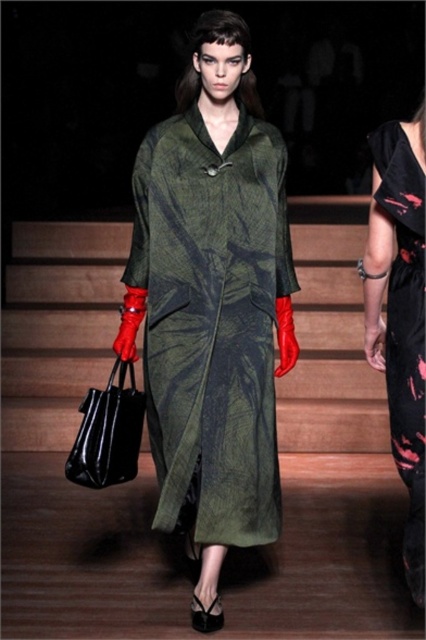
You are a photographer at a fashion show and need to position your camera to capture the matte green dress at center. According to the coordinates provided, where should you aim your camera?

You should aim your camera at the coordinates point [212,305] to capture the matte green dress at center.

You are a fashion designer observing the runway show. You notice the ripped black dress at right and the black leather bag at lower left. Which item has a narrower width?

The ripped black dress at right is thinner than the black leather bag at lower left, so the ripped black dress at right has a narrower width.

You are a photographer at the runway show and need to capture a photo where the matte green dress at center and the black leather bag at lower left are both visible. Considering their sizes, which object should you focus on to ensure both are in frame without cropping?

The matte green dress at center is much taller than the black leather bag at lower left, so you should focus on the matte green dress at center to ensure both are in frame without cropping.